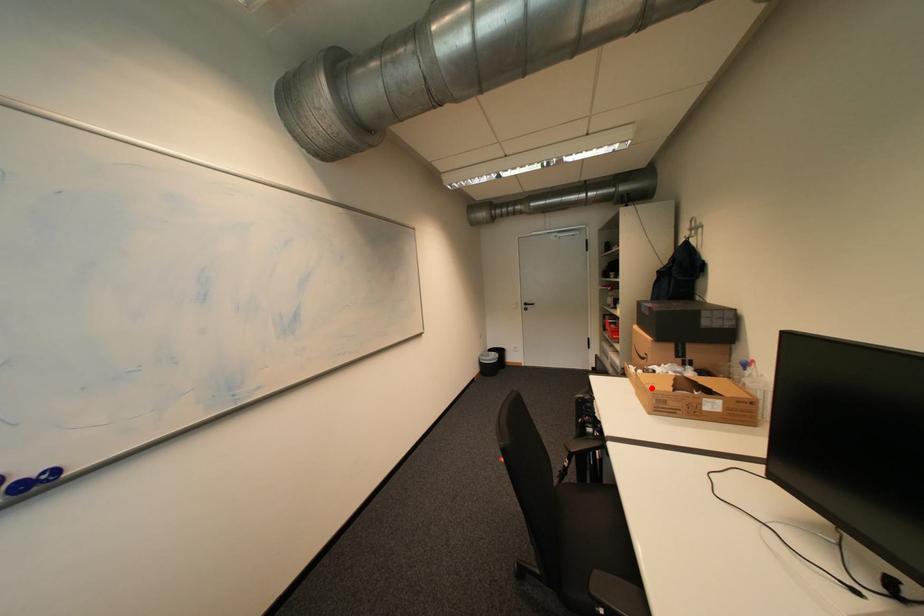
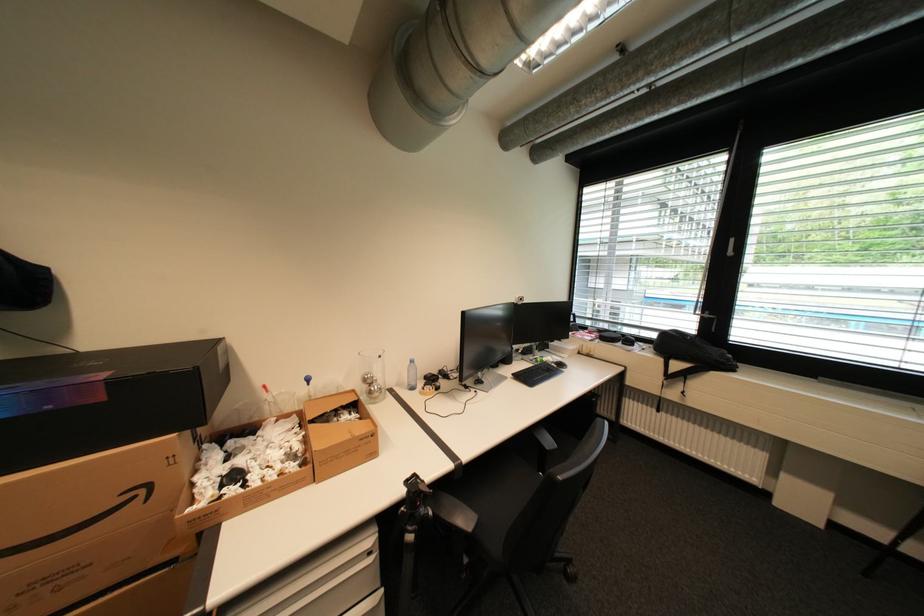
Question: I am providing you with two images of the same scene from different viewpoints. A red point is marked on the first image. Can you still see the location of the red point in image 2?

Choices:
 (A) Yes
 (B) No

Answer: (A)